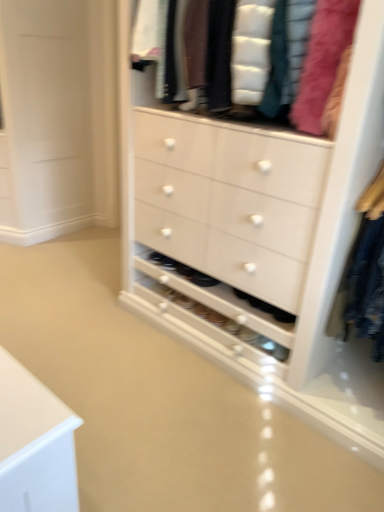
Image resolution: width=384 pixels, height=512 pixels. Describe the element at coordinates (305, 60) in the screenshot. I see `velvet fabric jackets at upper center` at that location.

In order to face velvet fabric jackets at upper center, should I rotate leftwards or rightwards?

It's best to rotate right around 7.607 degrees.

Find the location of a particular element. The height and width of the screenshot is (512, 384). velvet fabric jackets at upper center is located at coordinates (305, 60).

What is the approximate width of velvet fabric jackets at upper center?

velvet fabric jackets at upper center is 20.86 inches in width.

Locate an element on the screen. The image size is (384, 512). velvet fabric jackets at upper center is located at coordinates (305, 60).